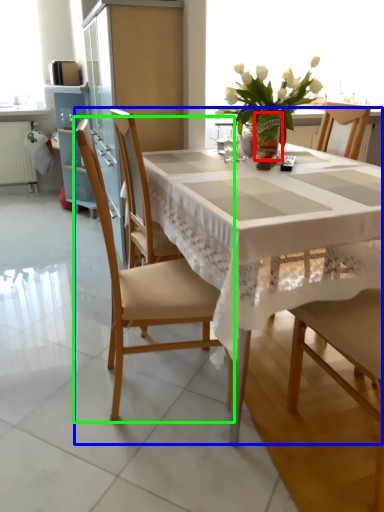
Question: Which is farther away from vase (highlighted by a red box)? kitchen & dining room table (highlighted by a blue box) or chair (highlighted by a green box)?

Choices:
 (A) kitchen & dining room table
 (B) chair

Answer: (B)